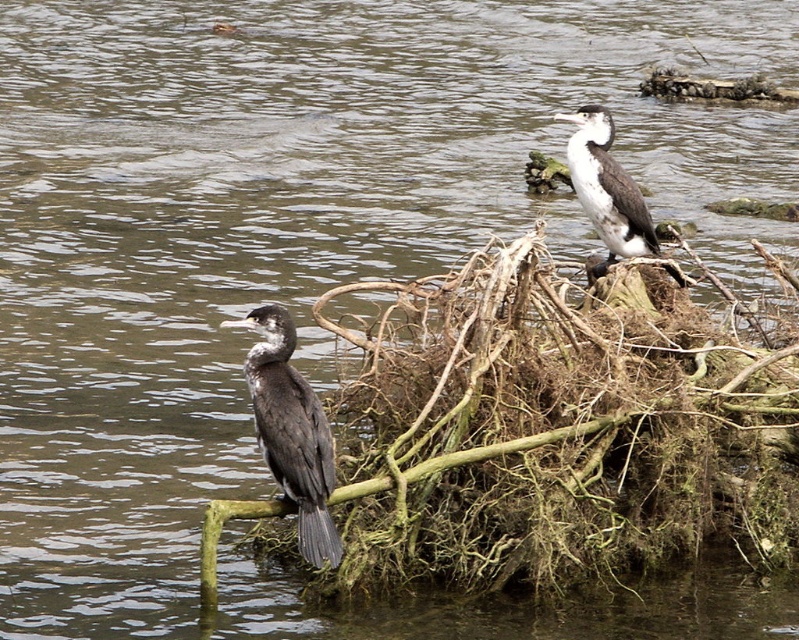
You are a wildlife photographer aiming to capture both the brown fibrous nest at lower center and the dark gray feathers at left in a single frame. Based on their positions, which object should you adjust your camera focus to first to ensure both are in the frame?

The brown fibrous nest at lower center is positioned on the right side of dark gray feathers at left. Since the dark gray feathers at left are on the left, you should focus on them first to ensure both objects are included in the frame.